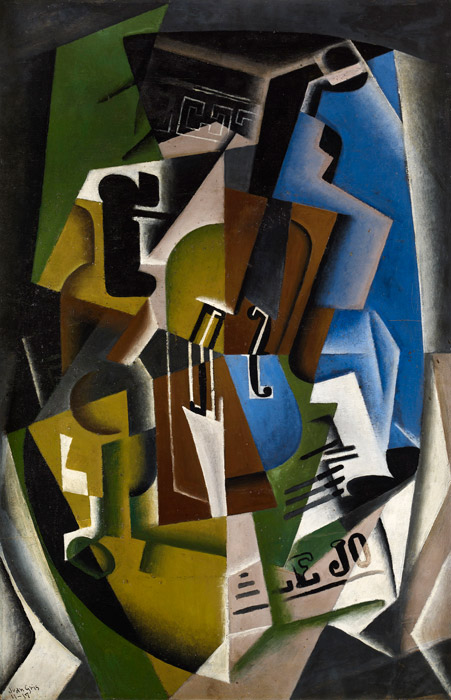
Locate an element on the screen. This screenshot has width=451, height=700. yellow paint is located at coordinates (206, 631).